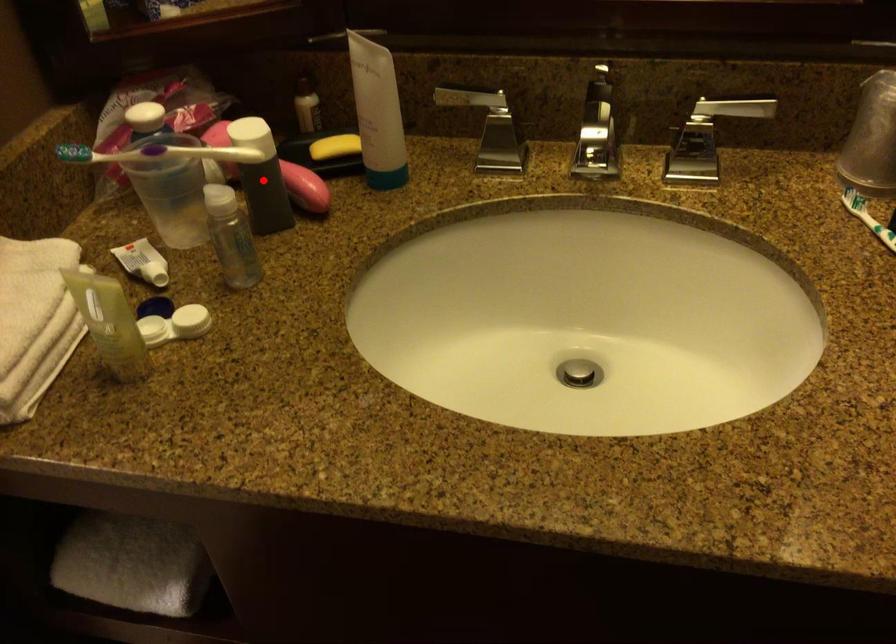
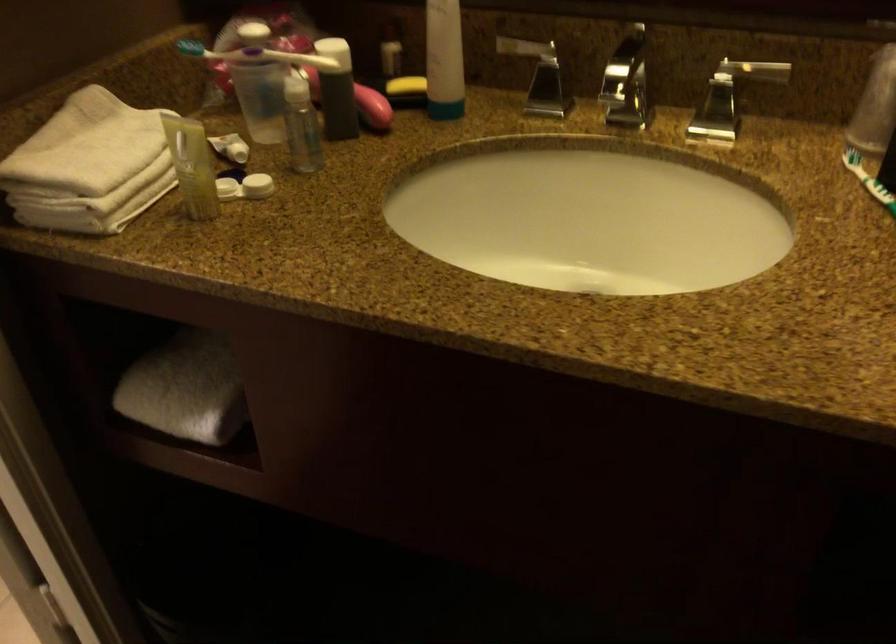
Question: I am providing you with two images of the same scene from different viewpoints. A red point is shown in image1. For the corresponding object point in image2, is it positioned nearer or farther from the camera?

Choices:
 (A) Nearer
 (B) Farther

Answer: (B)